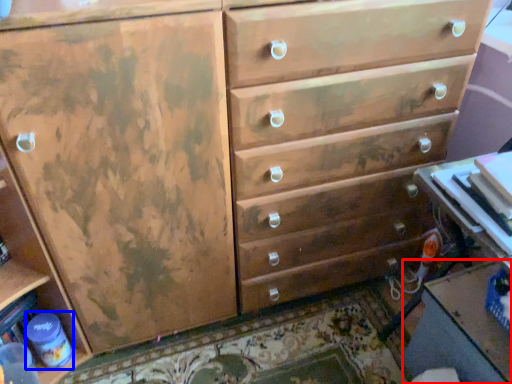
Question: Which object is further to the camera taking this photo, table (highlighted by a red box) or bottle (highlighted by a blue box)?

Choices:
 (A) table
 (B) bottle

Answer: (B)